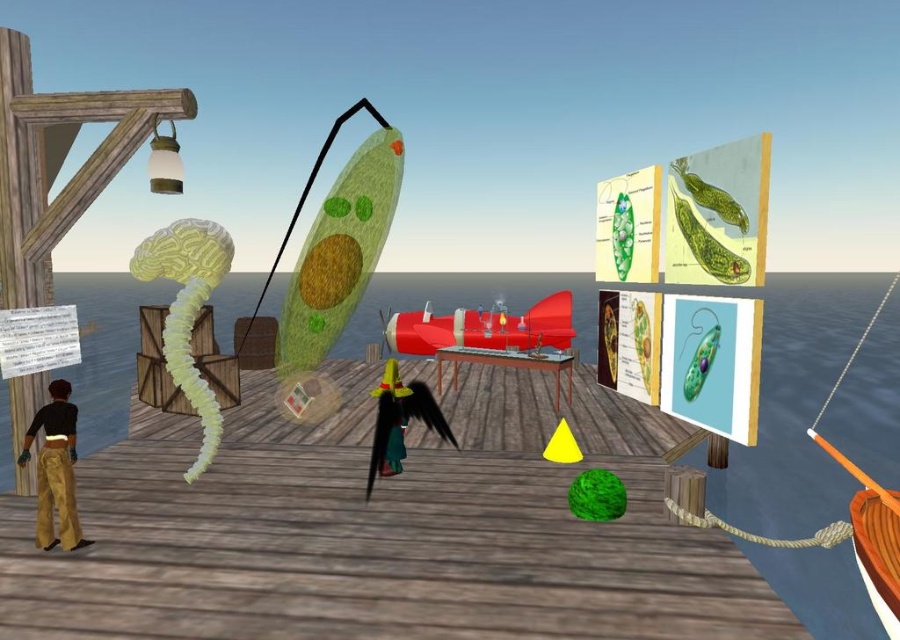
Question: Which point is closer to the camera?

Choices:
 (A) wooden boat at lower right
 (B) gold textured pants at lower left

Answer: (A)

Question: Is gold textured pants at lower left smaller than wooden boat at lower right?

Choices:
 (A) no
 (B) yes

Answer: (A)

Question: Is shiny red submarine at center bigger than gold textured pants at lower left?

Choices:
 (A) yes
 (B) no

Answer: (A)

Question: Which object is farther from the camera taking this photo?

Choices:
 (A) wooden boat at lower right
 (B) gold textured pants at lower left
 (C) shiny red submarine at center
 (D) transparent water at center

Answer: (C)

Question: Is transparent water at center smaller than wooden table at center?

Choices:
 (A) no
 (B) yes

Answer: (A)

Question: Which point is closer to the camera taking this photo?

Choices:
 (A) (50, 520)
 (B) (526, 355)
 (C) (544, 340)
 (D) (383, 301)

Answer: (A)